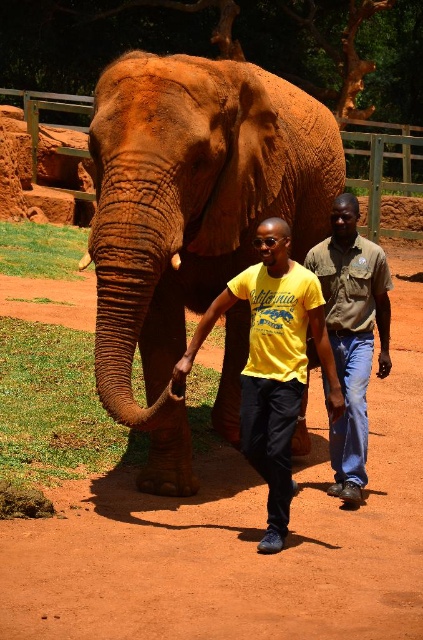
Question: Which point is farther to the camera?

Choices:
 (A) yellow t-shirt at center
 (B) brown textured elephant at center
 (C) khaki cotton shirt at center

Answer: (C)

Question: Which object is positioned farthest from the brown dirt field at center?

Choices:
 (A) khaki cotton shirt at center
 (B) brown textured elephant at center

Answer: (B)

Question: Can you confirm if yellow t-shirt at center is positioned to the right of khaki cotton shirt at center?

Choices:
 (A) no
 (B) yes

Answer: (A)

Question: Considering the relative positions of brown dirt field at center and khaki cotton shirt at center in the image provided, where is brown dirt field at center located with respect to khaki cotton shirt at center?

Choices:
 (A) above
 (B) below

Answer: (B)

Question: Can you confirm if yellow t-shirt at center is bigger than khaki cotton shirt at center?

Choices:
 (A) no
 (B) yes

Answer: (A)

Question: Among these objects, which one is farthest from the camera?

Choices:
 (A) brown dirt field at center
 (B) brown textured elephant at center
 (C) yellow t-shirt at center

Answer: (C)